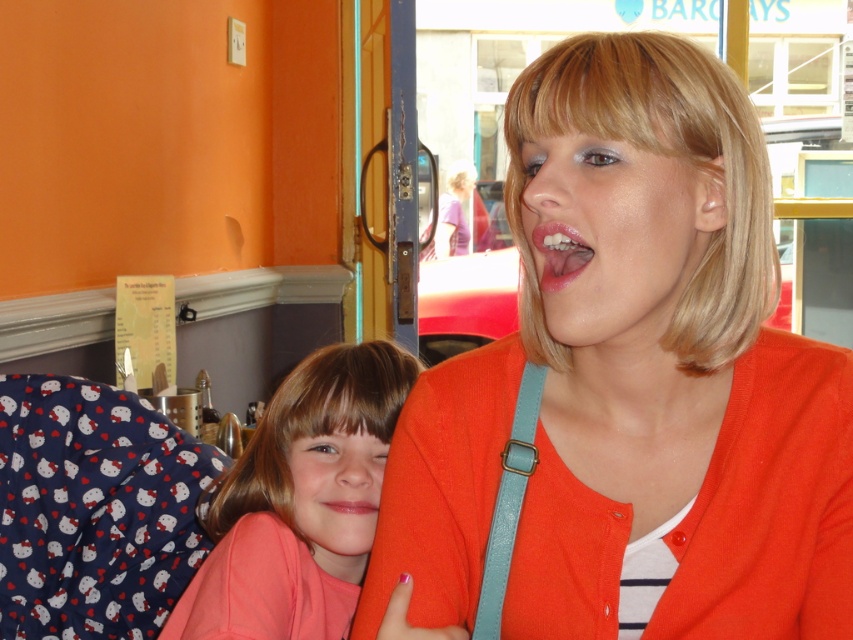
Is pink matte shirt at center in front of pink glossy lips at center?

Yes, it is in front of pink glossy lips at center.

Does point (323, 348) come in front of point (372, 509)?

No, it is behind (372, 509).

This screenshot has width=853, height=640. In order to click on pink matte shirt at center in this screenshot , I will do `click(299, 502)`.

Between point (697, 125) and point (347, 513), which one is positioned in front?

Point (697, 125) is more forward.

Does orange matte cardigan at center appear on the left side of pink glossy lips at center?

In fact, orange matte cardigan at center is to the right of pink glossy lips at center.

Who is more forward, (657, 273) or (358, 500)?

Point (657, 273) is in front.

The image size is (853, 640). Find the location of `orange matte cardigan at center`. orange matte cardigan at center is located at coordinates (631, 385).

What do you see at coordinates (558, 253) in the screenshot? I see `glossy pink lips at center` at bounding box center [558, 253].

Does glossy pink lips at center appear on the right side of pink glossy lips at center?

Indeed, glossy pink lips at center is positioned on the right side of pink glossy lips at center.

Image resolution: width=853 pixels, height=640 pixels. In order to click on glossy pink lips at center in this screenshot , I will do `click(558, 253)`.

Find the location of a particular element. The height and width of the screenshot is (640, 853). glossy pink lips at center is located at coordinates (558, 253).